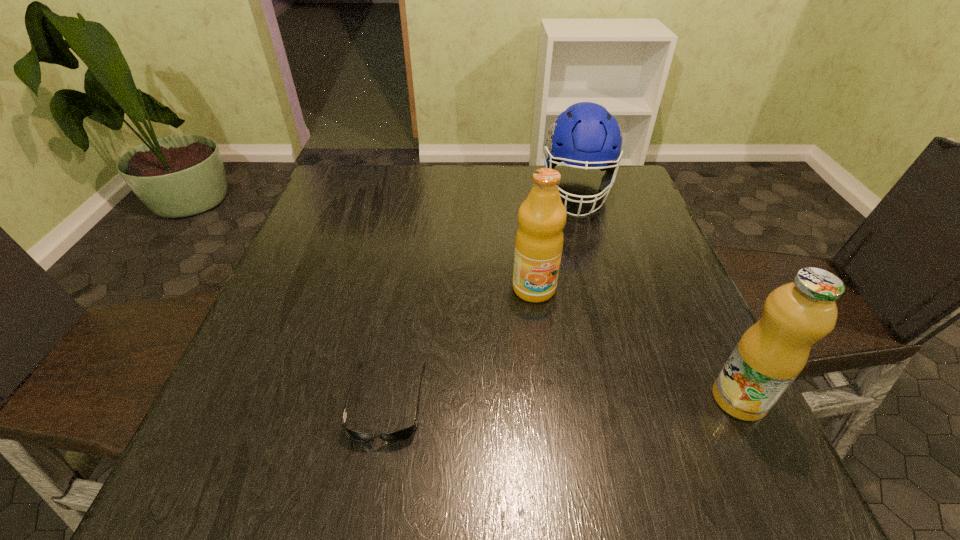
Identify the location of vacant spot on the desktop that is between the leftmost object and the rightmost object and is positioned on the front label of the third nearest object. (566, 400).

Locate an element on the screen. The image size is (960, 540). free spot on the desktop that is between the shortest object and the nearer fruit juice and is positioned on the face guard of the football helmet is located at coordinates (589, 400).